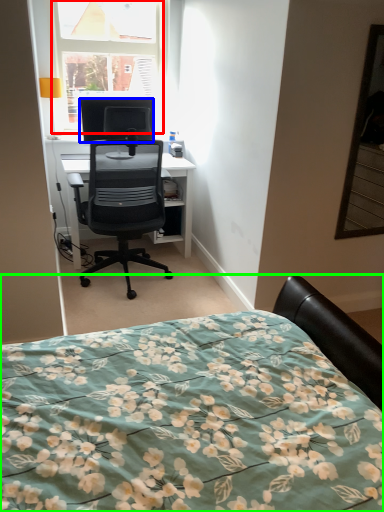
Question: Based on their relative distances, which object is farther from window (highlighted by a red box)? Choose from television (highlighted by a blue box) and bed (highlighted by a green box).

Choices:
 (A) television
 (B) bed

Answer: (B)